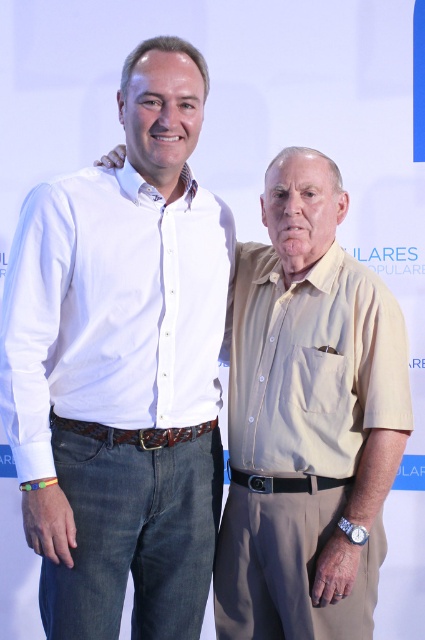
You are a photographer trying to focus on the white cotton shirt at upper left. What are the coordinates you should aim for?

The coordinates for the white cotton shirt at upper left are at point (122, 365).

You are a photographer setting up a photo shoot. You have two shirts to display side by side. The white cotton shirt at upper left and the matte khaki shirt at right. Based on the image provided, which shirt should you choose if you want the one that is wider for the display?

The white cotton shirt at upper left is wider than the matte khaki shirt at right, so you should choose the white cotton shirt at upper left for the display.

You are a photographer setting up a shoot. You need to position the white cotton shirt at upper left and the matte khaki shirt at right so that they are aligned horizontally. Based on the current setup, which adjustment should you make?

The white cotton shirt at upper left is located above the matte khaki shirt at right. To align them horizontally, you should lower the white cotton shirt at upper left or raise the matte khaki shirt at right until they are at the same height.